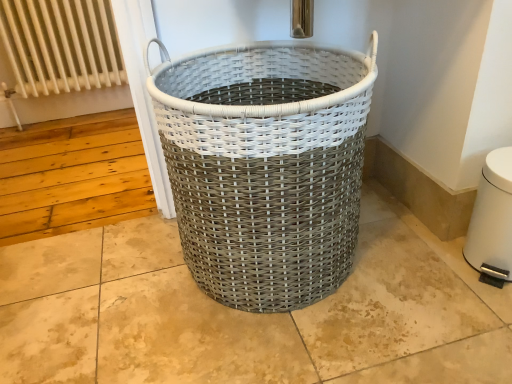
Question: Is point pyautogui.click(x=478, y=206) positioned closer to the camera than point pyautogui.click(x=67, y=6)?

Choices:
 (A) closer
 (B) farther

Answer: (A)

Question: From the image's perspective, relative to white metal radiator at upper left, is white plastic water heater at lower right above or below?

Choices:
 (A) above
 (B) below

Answer: (B)

Question: Considering the real-world distances, which object is closest to the white metal radiator at upper left?

Choices:
 (A) white woven basket at center
 (B) white plastic water heater at lower right

Answer: (A)

Question: Considering the real-world distances, which object is farthest from the white woven basket at center?

Choices:
 (A) white plastic water heater at lower right
 (B) white metal radiator at upper left

Answer: (B)